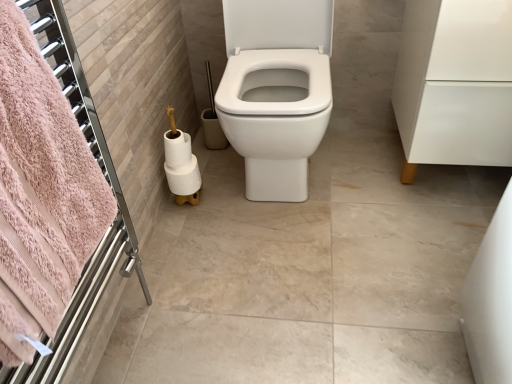
Question: Considering the relative sizes of white matte toilet paper at lower left, positioned as the 2th toilet paper in bottom-to-top order, and white glossy cabinet at right in the image provided, is white matte toilet paper at lower left, positioned as the 2th toilet paper in bottom-to-top order, bigger than white glossy cabinet at right?

Choices:
 (A) no
 (B) yes

Answer: (A)

Question: From the image's perspective, is white matte toilet paper at lower left, positioned as the 2th toilet paper in bottom-to-top order, under white glossy cabinet at right?

Choices:
 (A) yes
 (B) no

Answer: (A)

Question: Considering the relative sizes of white matte toilet paper at lower left, the second toilet paper from the top, and white glossy cabinet at right in the image provided, is white matte toilet paper at lower left, the second toilet paper from the top, taller than white glossy cabinet at right?

Choices:
 (A) no
 (B) yes

Answer: (A)

Question: Is the depth of white matte toilet paper at lower left, positioned as the 2th toilet paper in bottom-to-top order, greater than that of white glossy cabinet at right?

Choices:
 (A) no
 (B) yes

Answer: (B)

Question: Could you tell me if white matte toilet paper at lower left, positioned as the 2th toilet paper in bottom-to-top order, is facing white glossy cabinet at right?

Choices:
 (A) no
 (B) yes

Answer: (A)

Question: Can you confirm if white matte toilet paper at lower left, the second toilet paper from the top, is positioned to the left of white glossy cabinet at right?

Choices:
 (A) yes
 (B) no

Answer: (A)

Question: Does pink terry cloth towel at left turn towards white glossy toilet at center?

Choices:
 (A) no
 (B) yes

Answer: (A)

Question: Considering the relative sizes of pink terry cloth towel at left and white glossy toilet at center in the image provided, is pink terry cloth towel at left smaller than white glossy toilet at center?

Choices:
 (A) no
 (B) yes

Answer: (B)

Question: Is pink terry cloth towel at left in contact with white glossy toilet at center?

Choices:
 (A) yes
 (B) no

Answer: (B)

Question: Would you consider pink terry cloth towel at left to be distant from white glossy toilet at center?

Choices:
 (A) no
 (B) yes

Answer: (A)

Question: From a real-world perspective, is pink terry cloth towel at left positioned over white glossy toilet at center based on gravity?

Choices:
 (A) yes
 (B) no

Answer: (A)

Question: Is pink terry cloth towel at left closer to the viewer compared to white glossy toilet at center?

Choices:
 (A) yes
 (B) no

Answer: (A)

Question: Is white matte toilet paper at lower left, positioned as the 2th toilet paper in bottom-to-top order, in contact with white matte toilet paper at lower left, positioned as the third toilet paper in bottom-to-top order?

Choices:
 (A) no
 (B) yes

Answer: (B)